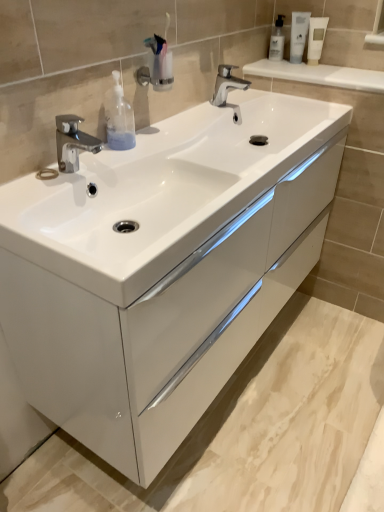
The image size is (384, 512). What do you see at coordinates (73, 142) in the screenshot?
I see `polished chrome faucet at left, which is the 2th tap in top-to-bottom order` at bounding box center [73, 142].

This screenshot has width=384, height=512. Describe the element at coordinates (298, 35) in the screenshot. I see `white glossy tube at upper right, placed as the 2th mouthwash when sorted from right to left` at that location.

Locate an element on the screen. This screenshot has width=384, height=512. white glossy tube at upper right, placed as the 2th mouthwash when sorted from right to left is located at coordinates (298, 35).

At what (x,y) coordinates should I click in order to perform the action: click on white glossy cabinet at center. Please return your answer as a coordinate pair (x, y). The height and width of the screenshot is (512, 384). Looking at the image, I should click on (164, 325).

What is the approximate width of white matte tube at upper right, positioned as the 3th mouthwash in left-to-right order?

The width of white matte tube at upper right, positioned as the 3th mouthwash in left-to-right order, is 4.22 centimeters.

Identify the location of polished chrome faucet at left, which is the 1th tap from left to right. The width and height of the screenshot is (384, 512). (73, 142).

Image resolution: width=384 pixels, height=512 pixels. I want to click on the 2nd tap positioned below the transparent plastic bottle at left (from a real-world perspective), so 228,89.

Based on the photo, is polished chrome faucet at center, acting as the 1th tap starting from the right, to the left or to the right of transparent plastic bottle at left in the image?

Clearly, polished chrome faucet at center, acting as the 1th tap starting from the right, is on the right of transparent plastic bottle at left in the image.

Can you confirm if polished chrome faucet at center, marked as the 2th tap in a bottom-to-top arrangement, is smaller than transparent plastic bottle at left?

Actually, polished chrome faucet at center, marked as the 2th tap in a bottom-to-top arrangement, might be larger than transparent plastic bottle at left.

How much distance is there between polished chrome faucet at center, the first tap positioned from the back, and transparent plastic bottle at left?

polished chrome faucet at center, the first tap positioned from the back, and transparent plastic bottle at left are 56.48 centimeters apart.

From the image's perspective, does white matte tube at upper right, positioned as the 3th mouthwash in left-to-right order, appear lower than white glossy sink at center?

Actually, white matte tube at upper right, positioned as the 3th mouthwash in left-to-right order, appears above white glossy sink at center in the image.

Can we say white matte tube at upper right, the first mouthwash viewed from the right, lies outside white glossy sink at center?

white matte tube at upper right, the first mouthwash viewed from the right, is positioned outside white glossy sink at center.

Between point (318, 19) and point (224, 147), which one is positioned in front?

Point (224, 147)

Is white matte tube at upper right, positioned as the 3th mouthwash in left-to-right order, taller or shorter than white glossy sink at center?

white matte tube at upper right, positioned as the 3th mouthwash in left-to-right order, is taller than white glossy sink at center.

Is the position of polished chrome faucet at left, which ranks as the first tap in front-to-back order, less distant than that of white glossy tube at upper right, placed as the 2th mouthwash when sorted from right to left?

Yes, polished chrome faucet at left, which ranks as the first tap in front-to-back order, is closer to the camera.

Considering the relative sizes of polished chrome faucet at left, placed as the second tap when sorted from back to front, and white glossy tube at upper right, which appears as the 2th mouthwash when viewed from the left, in the image provided, is polished chrome faucet at left, placed as the second tap when sorted from back to front, bigger than white glossy tube at upper right, which appears as the 2th mouthwash when viewed from the left,?

Correct, polished chrome faucet at left, placed as the second tap when sorted from back to front, is larger in size than white glossy tube at upper right, which appears as the 2th mouthwash when viewed from the left.

Between polished chrome faucet at left, which is counted as the 2th tap, starting from the right, and white glossy tube at upper right, placed as the 2th mouthwash when sorted from right to left, which one appears on the right side from the viewer's perspective?

white glossy tube at upper right, placed as the 2th mouthwash when sorted from right to left, is more to the right.

Does point (60, 142) lie in front of point (293, 49)?

Yes, it is.

Is white glossy cabinet at center thinner than clear plastic bottle at upper right, which ranks as the 3th mouthwash in right-to-left order?

No.

From the image's perspective, does white glossy cabinet at center appear higher than clear plastic bottle at upper right, which ranks as the 3th mouthwash in right-to-left order?

Actually, white glossy cabinet at center appears below clear plastic bottle at upper right, which ranks as the 3th mouthwash in right-to-left order, in the image.

Looking at this image, is white glossy cabinet at center positioned with its back to clear plastic bottle at upper right, which ranks as the 3th mouthwash in right-to-left order?

No, clear plastic bottle at upper right, which ranks as the 3th mouthwash in right-to-left order, is not at the back of white glossy cabinet at center.

Image resolution: width=384 pixels, height=512 pixels. I want to click on bathroom cabinet in front of the clear plastic bottle at upper right, which ranks as the 3th mouthwash in right-to-left order, so click(x=164, y=325).

From a real-world perspective, which is physically above, polished chrome faucet at center, the second tap in the left-to-right sequence, or white glossy cabinet at center?

polished chrome faucet at center, the second tap in the left-to-right sequence, from a real-world perspective.

Who is smaller, polished chrome faucet at center, acting as the 1th tap starting from the top, or white glossy cabinet at center?

With smaller size is polished chrome faucet at center, acting as the 1th tap starting from the top.

Which object is thinner, polished chrome faucet at center, acting as the 1th tap starting from the right, or white glossy cabinet at center?

polished chrome faucet at center, acting as the 1th tap starting from the right.

Is point (222, 99) in front of point (251, 319)?

No.

Could you tell me if clear plastic bottle at upper right, which is the first mouthwash in left-to-right order, is facing polished chrome faucet at left, which ranks as the first tap in front-to-back order?

Yes, clear plastic bottle at upper right, which is the first mouthwash in left-to-right order, is oriented towards polished chrome faucet at left, which ranks as the first tap in front-to-back order.

Find the location of a particular element. The width and height of the screenshot is (384, 512). tap that is the 2nd object to the left of the clear plastic bottle at upper right, which is the first mouthwash in left-to-right order, starting at the anchor is located at coordinates (73, 142).

Is clear plastic bottle at upper right, which ranks as the 3th mouthwash in right-to-left order, at the right side of polished chrome faucet at left, which is counted as the 2th tap, starting from the right?

Yes, clear plastic bottle at upper right, which ranks as the 3th mouthwash in right-to-left order, is to the right of polished chrome faucet at left, which is counted as the 2th tap, starting from the right.

Which object is more forward, clear plastic bottle at upper right, which ranks as the 3th mouthwash in right-to-left order, or polished chrome faucet at left, which is counted as the 2th tap, starting from the right?

polished chrome faucet at left, which is counted as the 2th tap, starting from the right, is in front.

Looking at this image, can you confirm if transparent plastic bottle at left is thinner than white glossy cabinet at center?

Yes, transparent plastic bottle at left is thinner than white glossy cabinet at center.

Which is more to the left, transparent plastic bottle at left or white glossy cabinet at center?

transparent plastic bottle at left is more to the left.

From a real-world perspective, is transparent plastic bottle at left above or below white glossy cabinet at center?

→ transparent plastic bottle at left is situated higher than white glossy cabinet at center in the real world.

Is transparent plastic bottle at left far from white glossy cabinet at center?

No, transparent plastic bottle at left is in close proximity to white glossy cabinet at center.

Where is `cleaning product in front of the polished chrome faucet at center, acting as the 1th tap starting from the top`? cleaning product in front of the polished chrome faucet at center, acting as the 1th tap starting from the top is located at coordinates (119, 117).

Locate an element on the screen. This screenshot has height=512, width=384. sink located on the left of white matte tube at upper right, the first mouthwash viewed from the right is located at coordinates (161, 191).

Which object lies further to the anchor point polished chrome faucet at center, acting as the 1th tap starting from the right, white glossy sink at center or white matte tube at upper right, the first mouthwash viewed from the right?

white glossy sink at center is positioned further to the anchor polished chrome faucet at center, acting as the 1th tap starting from the right.

Estimate the real-world distances between objects in this image. Which object is further from white glossy tube at upper right, placed as the 2th mouthwash when sorted from right to left, white glossy cabinet at center or clear plastic bottle at upper right, which is the first mouthwash in left-to-right order?

Based on the image, white glossy cabinet at center appears to be further to white glossy tube at upper right, placed as the 2th mouthwash when sorted from right to left.

Based on their spatial positions, is white glossy sink at center or white matte tube at upper right, the first mouthwash viewed from the right, further from transparent plastic bottle at left?

Based on the image, white matte tube at upper right, the first mouthwash viewed from the right, appears to be further to transparent plastic bottle at left.

Based on their spatial positions, is polished chrome faucet at left, placed as the second tap when sorted from back to front, or transparent plastic bottle at left closer to white glossy tube at upper right, which appears as the 2th mouthwash when viewed from the left?

transparent plastic bottle at left.

From the image, which object appears to be farther from polished chrome faucet at left, which is the 2th tap in top-to-bottom order, white glossy tube at upper right, placed as the 2th mouthwash when sorted from right to left, or transparent plastic bottle at left?

Among the two, white glossy tube at upper right, placed as the 2th mouthwash when sorted from right to left, is located further to polished chrome faucet at left, which is the 2th tap in top-to-bottom order.

Considering their positions, is clear plastic bottle at upper right, which is the first mouthwash in left-to-right order, positioned further to white glossy sink at center than polished chrome faucet at left, which is the 1th tap from left to right?

Based on the image, clear plastic bottle at upper right, which is the first mouthwash in left-to-right order, appears to be further to white glossy sink at center.

Which object lies nearer to the anchor point transparent plastic bottle at left, white matte tube at upper right, the first mouthwash viewed from the right, or white glossy tube at upper right, placed as the 2th mouthwash when sorted from right to left?

Among the two, white glossy tube at upper right, placed as the 2th mouthwash when sorted from right to left, is located nearer to transparent plastic bottle at left.

When comparing their distances from white glossy sink at center, does polished chrome faucet at center, marked as the 2th tap in a bottom-to-top arrangement, or white glossy tube at upper right, which appears as the 2th mouthwash when viewed from the left, seem closer?

Among the two, polished chrome faucet at center, marked as the 2th tap in a bottom-to-top arrangement, is located nearer to white glossy sink at center.

You are a GUI agent. You are given a task and a screenshot of the screen. Output one action in this format:
    pyautogui.click(x=<x>, y=<y>)
    Task: Click on the sink between polished chrome faucet at left, which ranks as the first tap in front-to-back order, and white glossy cabinet at center
    
    Given the screenshot: What is the action you would take?
    pyautogui.click(x=161, y=191)

Where is `tap positioned between white glossy sink at center and polished chrome faucet at center, arranged as the second tap when viewed from the front, from near to far`? This screenshot has height=512, width=384. tap positioned between white glossy sink at center and polished chrome faucet at center, arranged as the second tap when viewed from the front, from near to far is located at coordinates (73, 142).

Identify the location of cleaning product between white glossy sink at center and white glossy tube at upper right, placed as the 2th mouthwash when sorted from right to left, along the z-axis. This screenshot has height=512, width=384. (119, 117).

Where is `cleaning product between white glossy sink at center and clear plastic bottle at upper right, which ranks as the 3th mouthwash in right-to-left order, in the front-back direction`? This screenshot has height=512, width=384. cleaning product between white glossy sink at center and clear plastic bottle at upper right, which ranks as the 3th mouthwash in right-to-left order, in the front-back direction is located at coordinates (119, 117).